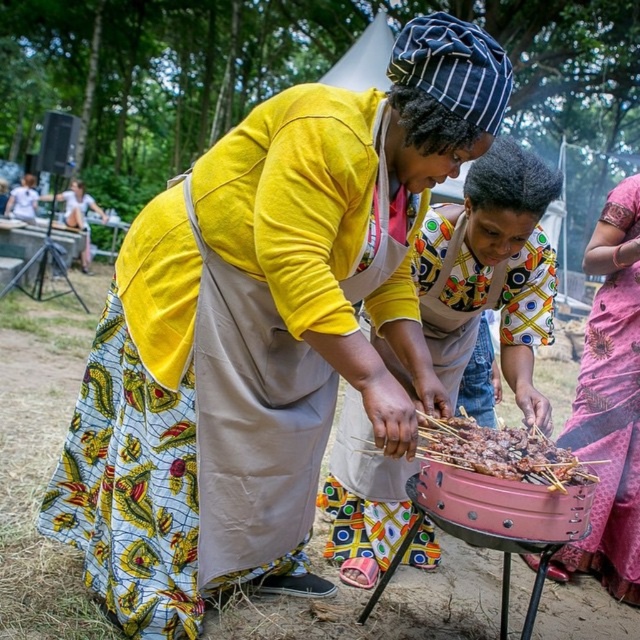
Question: Is printed fabric shirt at center thinner than pink fabric dress at right?

Choices:
 (A) yes
 (B) no

Answer: (B)

Question: Among these objects, which one is farthest from the camera?

Choices:
 (A) brown charred skewers at center
 (B) pink fabric dress at right

Answer: (B)

Question: Which point is farther from the camera taking this photo?

Choices:
 (A) (586, 250)
 (B) (465, 460)

Answer: (A)

Question: Does printed fabric shirt at center appear on the right side of brown charred skewers at center?

Choices:
 (A) yes
 (B) no

Answer: (A)

Question: Can you confirm if pink fabric dress at right is positioned below brown charred skewers at center?

Choices:
 (A) yes
 (B) no

Answer: (B)

Question: Which object is closer to the camera taking this photo?

Choices:
 (A) pink fabric dress at right
 (B) printed fabric shirt at center

Answer: (B)